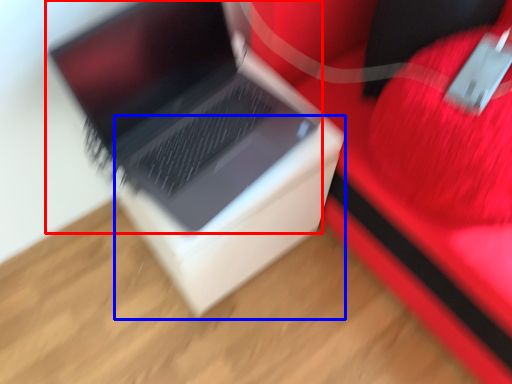
Question: Among these objects, which one is nearest to the camera, laptop (highlighted by a red box) or cardboard box (highlighted by a blue box)?

Choices:
 (A) laptop
 (B) cardboard box

Answer: (A)